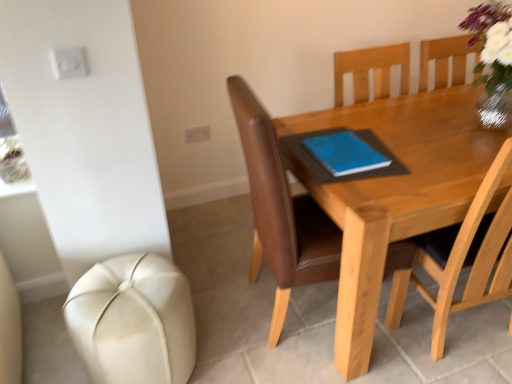
Question: Would you say white leather ottoman at lower left contains wooden table at center?

Choices:
 (A) yes
 (B) no

Answer: (B)

Question: Is white leather ottoman at lower left to the left of wooden table at center from the viewer's perspective?

Choices:
 (A) yes
 (B) no

Answer: (A)

Question: Can you confirm if white leather ottoman at lower left is thinner than wooden table at center?

Choices:
 (A) no
 (B) yes

Answer: (B)

Question: Is white leather ottoman at lower left taller than wooden table at center?

Choices:
 (A) yes
 (B) no

Answer: (B)

Question: Could you tell me if white leather ottoman at lower left is turned towards wooden table at center?

Choices:
 (A) yes
 (B) no

Answer: (B)

Question: Is wooden table at center to the left or to the right of blue matte notebook at center in the image?

Choices:
 (A) left
 (B) right

Answer: (B)

Question: In the image, is wooden table at center positioned in front of or behind blue matte notebook at center?

Choices:
 (A) front
 (B) behind

Answer: (A)

Question: Is point (462, 114) closer or farther from the camera than point (347, 139)?

Choices:
 (A) closer
 (B) farther

Answer: (B)

Question: Is wooden table at center wider or thinner than blue matte notebook at center?

Choices:
 (A) thin
 (B) wide

Answer: (B)

Question: Considering the positions of white leather ottoman at lower left and blue matte notebook at center in the image, is white leather ottoman at lower left bigger or smaller than blue matte notebook at center?

Choices:
 (A) small
 (B) big

Answer: (B)

Question: Based on their positions, is white leather ottoman at lower left located to the left or right of blue matte notebook at center?

Choices:
 (A) left
 (B) right

Answer: (A)

Question: Is white leather ottoman at lower left taller or shorter than blue matte notebook at center?

Choices:
 (A) tall
 (B) short

Answer: (A)

Question: From the image's perspective, is white leather ottoman at lower left above or below blue matte notebook at center?

Choices:
 (A) below
 (B) above

Answer: (A)

Question: Relative to white leather ottoman at lower left, is wooden table at center in front or behind?

Choices:
 (A) behind
 (B) front

Answer: (B)

Question: In the image, is wooden table at center on the left side or the right side of white leather ottoman at lower left?

Choices:
 (A) left
 (B) right

Answer: (B)